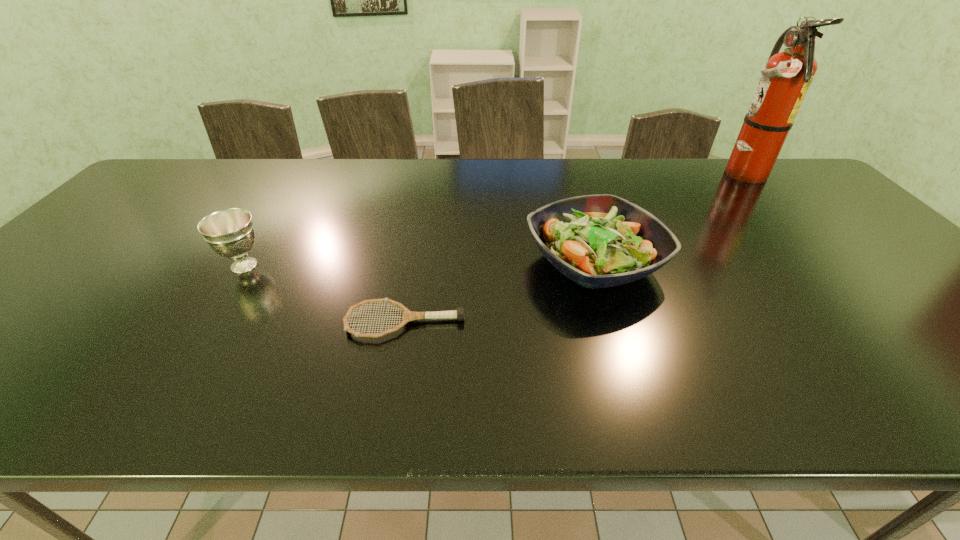
This screenshot has height=540, width=960. What are the coordinates of `free space that is in between the leftmost object and the third object from right to left` in the screenshot? It's located at (324, 294).

Where is `vacant space that's between the chalice and the third object from left to right`? This screenshot has height=540, width=960. vacant space that's between the chalice and the third object from left to right is located at coordinates (420, 264).

This screenshot has height=540, width=960. Find the location of `free space between the third object from left to right and the leftmost object`. free space between the third object from left to right and the leftmost object is located at coordinates (420, 264).

In order to click on empty space that is in between the tallest object and the salad plate in this screenshot , I will do `click(667, 218)`.

You are a GUI agent. You are given a task and a screenshot of the screen. Output one action in this format:
    pyautogui.click(x=<x>, y=<y>)
    Task: Click on the free spot between the salad plate and the tennis racket
    The width and height of the screenshot is (960, 540).
    Given the screenshot: What is the action you would take?
    pyautogui.click(x=500, y=292)

You are a GUI agent. You are given a task and a screenshot of the screen. Output one action in this format:
    pyautogui.click(x=<x>, y=<y>)
    Task: Click on the vacant point located between the tennis racket and the chalice
    This screenshot has height=540, width=960.
    Given the screenshot: What is the action you would take?
    click(324, 294)

At what (x,y) coordinates should I click in order to perform the action: click on free space between the chalice and the second object from right to left. Please return your answer as a coordinate pair (x, y). This screenshot has height=540, width=960. Looking at the image, I should click on (420, 264).

Where is `object that can be found as the second closest to the tallest object`? This screenshot has width=960, height=540. object that can be found as the second closest to the tallest object is located at coordinates (459, 314).

Locate an element on the screen. The image size is (960, 540). the third closest object to the farthest object is located at coordinates (230, 232).

In order to click on vacant area that satisfies the following two spatial constraints: 1. on the front side of the tennis racket; 2. on the left side of the leftmost object in this screenshot , I will do `click(208, 322)`.